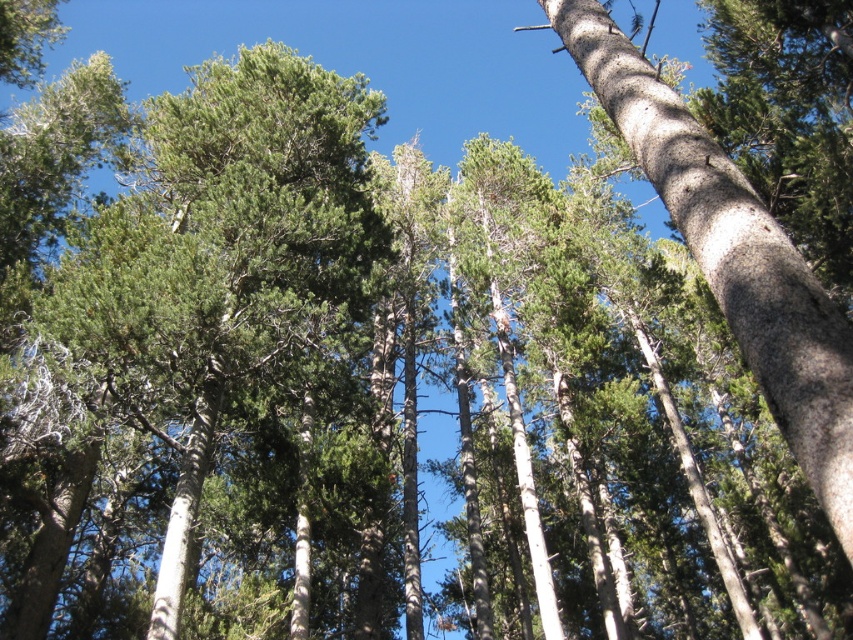
Question: Can you confirm if green needle-like at upper left is wider than smooth gray bark at center?

Choices:
 (A) yes
 (B) no

Answer: (A)

Question: Which object is closer to the camera taking this photo?

Choices:
 (A) smooth gray bark at center
 (B) green needle-like at upper left

Answer: (A)

Question: Does green needle-like at upper left appear on the left side of smooth gray bark at center?

Choices:
 (A) yes
 (B) no

Answer: (A)

Question: Can you confirm if green needle-like at upper left is positioned to the right of smooth gray bark at center?

Choices:
 (A) no
 (B) yes

Answer: (A)